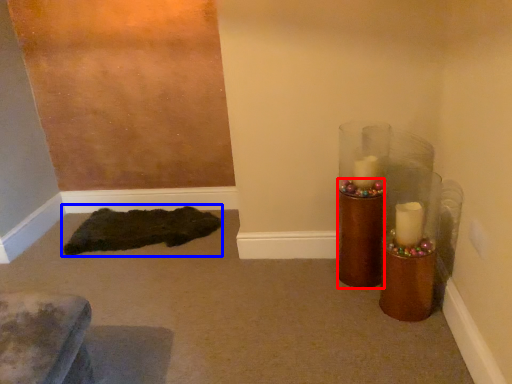
Question: Which object appears farthest to the camera in this image, candle holder (highlighted by a red box) or mat (highlighted by a blue box)?

Choices:
 (A) candle holder
 (B) mat

Answer: (B)